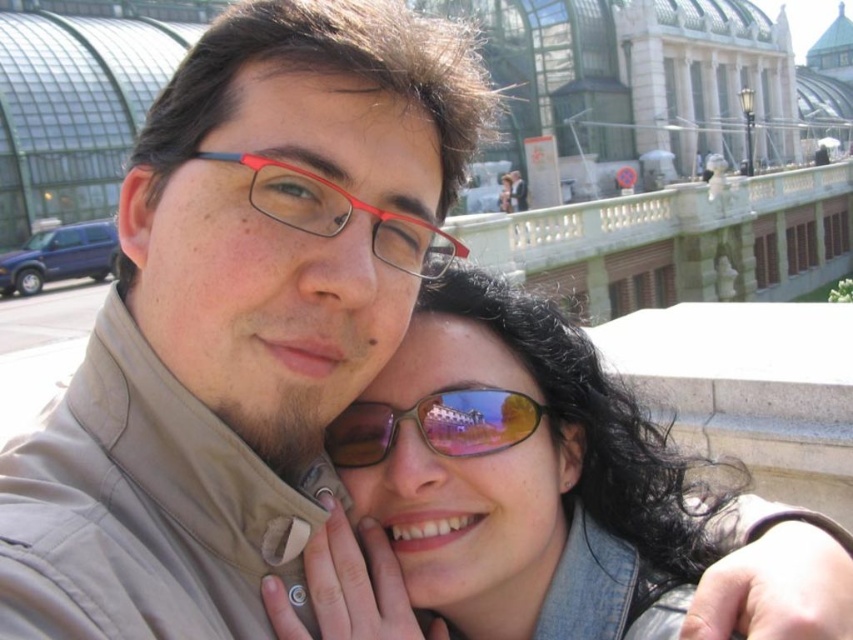
Question: Does matte black sunglasses at center lie in front of brown reflective sunglasses at center?

Choices:
 (A) yes
 (B) no

Answer: (A)

Question: Is matte beige jacket at center further to the viewer compared to matte black sunglasses at center?

Choices:
 (A) yes
 (B) no

Answer: (B)

Question: Does matte beige jacket at center appear on the right side of matte black sunglasses at center?

Choices:
 (A) yes
 (B) no

Answer: (B)

Question: Which of the following is the farthest from the observer?

Choices:
 (A) (460, 381)
 (B) (346, 195)

Answer: (A)

Question: Which object is the closest to the matte beige jacket at center?

Choices:
 (A) matte black sunglasses at center
 (B) matte plastic glasses at center
 (C) brown reflective sunglasses at center

Answer: (B)

Question: Among these objects, which one is farthest from the camera?

Choices:
 (A) matte plastic glasses at center
 (B) matte black sunglasses at center
 (C) brown reflective sunglasses at center
 (D) matte beige jacket at center

Answer: (C)